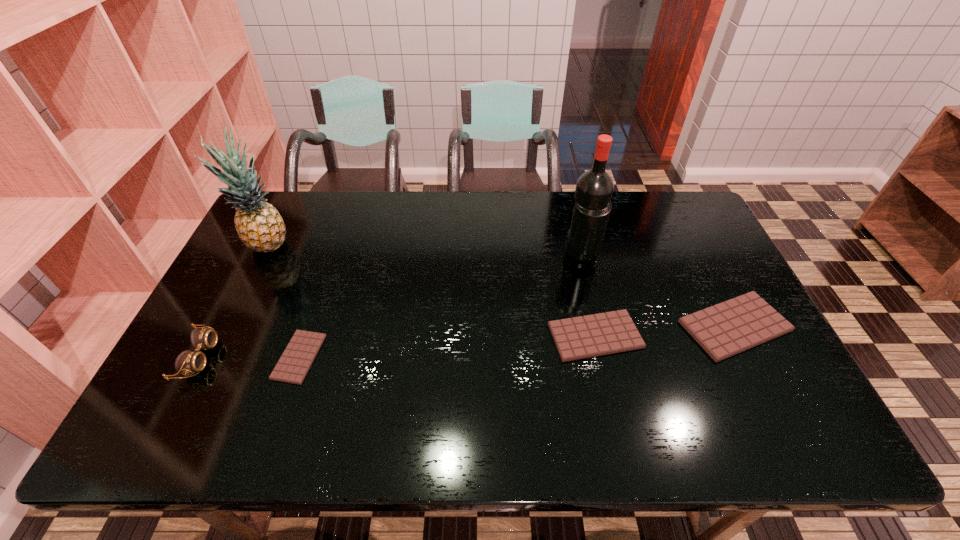
The image size is (960, 540). I want to click on chocolate bar that stands as the second closest to the fifth tallest object, so click(292, 367).

This screenshot has height=540, width=960. Identify the location of the third closest chocolate bar to the fourth shortest object. pyautogui.click(x=728, y=328).

Image resolution: width=960 pixels, height=540 pixels. I want to click on free location that satisfies the following two spatial constraints: 1. on the front side of the rightmost chocolate bar; 2. through the lenses of the fourth shortest object, so click(751, 357).

Find the location of a particular element. Image resolution: width=960 pixels, height=540 pixels. vacant point that satisfies the following two spatial constraints: 1. on the front side of the pineapple; 2. through the lenses of the fourth shortest object is located at coordinates (216, 357).

You are a GUI agent. You are given a task and a screenshot of the screen. Output one action in this format:
    pyautogui.click(x=<x>, y=<y>)
    Task: Click on the blank space that satisfies the following two spatial constraints: 1. on the front side of the pineapple; 2. on the right side of the rightmost object
    
    Given the screenshot: What is the action you would take?
    pyautogui.click(x=231, y=326)

In order to click on vacant position in the image that satisfies the following two spatial constraints: 1. on the front side of the rightmost chocolate bar; 2. through the lenses of the goggles in this screenshot , I will do `click(751, 357)`.

At what (x,y) coordinates should I click in order to perform the action: click on vacant space that satisfies the following two spatial constraints: 1. on the front side of the pineapple; 2. on the right side of the wine bottle. Please return your answer as a coordinate pair (x, y). Image resolution: width=960 pixels, height=540 pixels. Looking at the image, I should click on (267, 253).

At what (x,y) coordinates should I click in order to perform the action: click on blank space that satisfies the following two spatial constraints: 1. on the front side of the rightmost chocolate bar; 2. on the right side of the wine bottle. Please return your answer as a coordinate pair (x, y). Looking at the image, I should click on (598, 326).